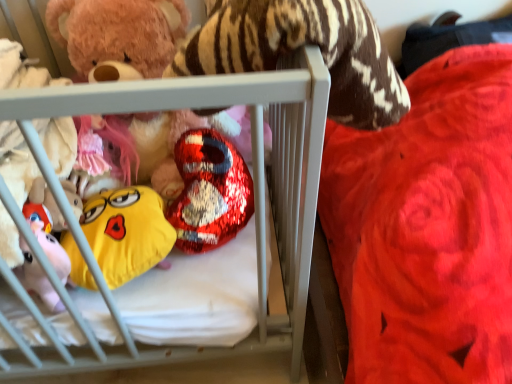
Question: Should I look upward or downward to see shiny metallic heart at center, which is the second toy from bottom to top?

Choices:
 (A) down
 (B) up

Answer: (B)

Question: Does soft white crib at center have a smaller size compared to yellow plush emoji at center, which is the third toy from top to bottom?

Choices:
 (A) no
 (B) yes

Answer: (A)

Question: Is soft white crib at center to the right of yellow plush emoji at center, marked as the first toy in a bottom-to-top arrangement, from the viewer's perspective?

Choices:
 (A) yes
 (B) no

Answer: (B)

Question: From a real-world perspective, is soft white crib at center located beneath yellow plush emoji at center, marked as the first toy in a bottom-to-top arrangement?

Choices:
 (A) yes
 (B) no

Answer: (B)

Question: Considering the relative sizes of soft white crib at center and yellow plush emoji at center, which is the third toy from top to bottom, in the image provided, is soft white crib at center thinner than yellow plush emoji at center, which is the third toy from top to bottom,?

Choices:
 (A) no
 (B) yes

Answer: (A)

Question: Is soft white crib at center touching yellow plush emoji at center, which is the third toy from top to bottom?

Choices:
 (A) yes
 (B) no

Answer: (B)

Question: Is soft white crib at center oriented towards yellow plush emoji at center, which is the third toy from top to bottom?

Choices:
 (A) yes
 (B) no

Answer: (A)

Question: Does shiny metallic heart at center, acting as the 2th toy starting from the top, have a lesser width compared to soft white crib at center?

Choices:
 (A) no
 (B) yes

Answer: (B)

Question: Is soft white crib at center a part of shiny metallic heart at center, which is the second toy from bottom to top?

Choices:
 (A) yes
 (B) no

Answer: (B)

Question: Does shiny metallic heart at center, acting as the 2th toy starting from the top, lie behind soft white crib at center?

Choices:
 (A) yes
 (B) no

Answer: (A)

Question: Does shiny metallic heart at center, which is the second toy from bottom to top, have a lesser height compared to soft white crib at center?

Choices:
 (A) yes
 (B) no

Answer: (A)

Question: Is shiny metallic heart at center, acting as the 2th toy starting from the top, taller than soft white crib at center?

Choices:
 (A) yes
 (B) no

Answer: (B)

Question: From a real-world perspective, is shiny metallic heart at center, acting as the 2th toy starting from the top, located higher than soft white crib at center?

Choices:
 (A) no
 (B) yes

Answer: (A)

Question: From a real-world perspective, is shiny metallic heart at center, marked as the third toy in a bottom-to-top arrangement, physically below yellow plush emoji at center, which is the third toy from top to bottom?

Choices:
 (A) no
 (B) yes

Answer: (A)